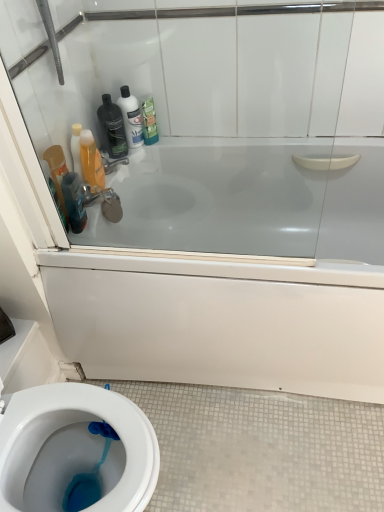
In order to click on translucent plastic bottle at upper center, arranged as the 2th cleaning product when viewed from the left in this screenshot , I will do `click(131, 117)`.

What do you see at coordinates (112, 162) in the screenshot? The image size is (384, 512). I see `matte silver faucet at upper left` at bounding box center [112, 162].

Describe the element at coordinates (74, 201) in the screenshot. I see `translucent plastic mouthwash at left, positioned as the first mouthwash in right-to-left order` at that location.

This screenshot has width=384, height=512. What do you see at coordinates (57, 174) in the screenshot?
I see `translucent plastic mouthwash at left, acting as the second mouthwash starting from the right` at bounding box center [57, 174].

This screenshot has height=512, width=384. Describe the element at coordinates (216, 120) in the screenshot. I see `transparent glass door at upper center` at that location.

Find the location of a particular element. Image resolution: width=384 pixels, height=512 pixels. translucent plastic bottle at upper center, the second cleaning product from the right is located at coordinates (131, 117).

Does point (59, 155) come closer to viewer compared to point (111, 139)?

Yes, point (59, 155) is in front of point (111, 139).

Consider the image. What's the angular difference between translucent plastic mouthwash at left, acting as the first mouthwash starting from the left, and matte black bottle at upper left's facing directions?

They differ by 35.9 degrees in their facing directions.

Which of these two, translucent plastic mouthwash at left, acting as the first mouthwash starting from the left, or matte black bottle at upper left, is smaller?

translucent plastic mouthwash at left, acting as the first mouthwash starting from the left.

Starting from the matte black bottle at upper left, which mouthwash is the 2nd one to the left? Please provide its 2D coordinates.

[(57, 174)]

Is translucent plastic mouthwash at left, which is the 2th mouthwash in left-to-right order, inside matte silver faucet at upper left?

No.

Considering the sizes of objects matte silver faucet at upper left and translucent plastic mouthwash at left, positioned as the first mouthwash in right-to-left order, in the image provided, who is thinner, matte silver faucet at upper left or translucent plastic mouthwash at left, positioned as the first mouthwash in right-to-left order,?

translucent plastic mouthwash at left, positioned as the first mouthwash in right-to-left order.

Is matte silver faucet at upper left in front of or behind translucent plastic mouthwash at left, which is the 2th mouthwash in left-to-right order, in the image?

matte silver faucet at upper left is positioned farther from the viewer than translucent plastic mouthwash at left, which is the 2th mouthwash in left-to-right order.

Can you see matte silver faucet at upper left touching translucent plastic mouthwash at left, positioned as the first mouthwash in right-to-left order?

No, matte silver faucet at upper left is not in contact with translucent plastic mouthwash at left, positioned as the first mouthwash in right-to-left order.

Is the position of white glossy bathtub at upper center more distant than that of translucent orange bottle at upper left, which appears as the 3th cleaning product when viewed from the right?

No, white glossy bathtub at upper center is closer to the camera.

Find the location of a particular element. This screenshot has width=384, height=512. bath on the right of translucent orange bottle at upper left, the 1th cleaning product in the left-to-right sequence is located at coordinates (240, 303).

From a real-world perspective, is white glossy bathtub at upper center physically located above or below translucent orange bottle at upper left, the 1th cleaning product in the left-to-right sequence?

white glossy bathtub at upper center is below translucent orange bottle at upper left, the 1th cleaning product in the left-to-right sequence.

Is white glossy bathtub at upper center far away from translucent orange bottle at upper left, which appears as the 3th cleaning product when viewed from the right?

No, white glossy bathtub at upper center is not far from translucent orange bottle at upper left, which appears as the 3th cleaning product when viewed from the right.

Which of these two, translucent plastic mouthwash at left, positioned as the first mouthwash in right-to-left order, or translucent plastic mouthwash at left, acting as the first mouthwash starting from the left, stands shorter?

Standing shorter between the two is translucent plastic mouthwash at left, positioned as the first mouthwash in right-to-left order.

Is translucent plastic mouthwash at left, acting as the second mouthwash starting from the right, at the back of translucent plastic mouthwash at left, which is the 2th mouthwash in left-to-right order?

Yes, translucent plastic mouthwash at left, which is the 2th mouthwash in left-to-right order,'s orientation is away from translucent plastic mouthwash at left, acting as the second mouthwash starting from the right.

Which is behind, point (80, 225) or point (58, 191)?

The point (80, 225) is farther.

Considering the sizes of translucent plastic mouthwash at left, positioned as the first mouthwash in right-to-left order, and translucent plastic mouthwash at left, acting as the second mouthwash starting from the right, in the image, is translucent plastic mouthwash at left, positioned as the first mouthwash in right-to-left order, wider or thinner than translucent plastic mouthwash at left, acting as the second mouthwash starting from the right,?

Clearly, translucent plastic mouthwash at left, positioned as the first mouthwash in right-to-left order, has less width compared to translucent plastic mouthwash at left, acting as the second mouthwash starting from the right.

Considering the relative positions of translucent orange bottle at upper left, which appears as the 3th cleaning product when viewed from the right, and white glossy bathtub at upper center in the image provided, is translucent orange bottle at upper left, which appears as the 3th cleaning product when viewed from the right, to the left or to the right of white glossy bathtub at upper center?

In the image, translucent orange bottle at upper left, which appears as the 3th cleaning product when viewed from the right, appears on the left side of white glossy bathtub at upper center.

From the picture: Does translucent orange bottle at upper left, the 1th cleaning product in the left-to-right sequence, touch white glossy bathtub at upper center?

translucent orange bottle at upper left, the 1th cleaning product in the left-to-right sequence, and white glossy bathtub at upper center are not in contact.

Considering the relative sizes of translucent orange bottle at upper left, which appears as the 3th cleaning product when viewed from the right, and white glossy bathtub at upper center in the image provided, is translucent orange bottle at upper left, which appears as the 3th cleaning product when viewed from the right, taller than white glossy bathtub at upper center?

In fact, translucent orange bottle at upper left, which appears as the 3th cleaning product when viewed from the right, may be shorter than white glossy bathtub at upper center.

Looking at this image, considering their positions, is translucent orange bottle at upper left, which appears as the 3th cleaning product when viewed from the right, located in front of or behind white glossy bathtub at upper center?

Visually, translucent orange bottle at upper left, which appears as the 3th cleaning product when viewed from the right, is located behind white glossy bathtub at upper center.

From a real-world perspective, who is located higher, translucent plastic mouthwash at left, which is the 2th mouthwash in left-to-right order, or translucent plastic bottle at upper center, the second cleaning product from the right?

In real-world perspective, translucent plastic bottle at upper center, the second cleaning product from the right, is above.

Considering the sizes of translucent plastic mouthwash at left, which is the 2th mouthwash in left-to-right order, and translucent plastic bottle at upper center, arranged as the 2th cleaning product when viewed from the left, in the image, is translucent plastic mouthwash at left, which is the 2th mouthwash in left-to-right order, taller or shorter than translucent plastic bottle at upper center, arranged as the 2th cleaning product when viewed from the left,?

translucent plastic mouthwash at left, which is the 2th mouthwash in left-to-right order, is shorter than translucent plastic bottle at upper center, arranged as the 2th cleaning product when viewed from the left.

Does point (71, 199) appear closer or farther from the camera than point (129, 104)?

Point (71, 199) appears to be closer to the viewer than point (129, 104).

Which is more to the right, translucent plastic mouthwash at left, positioned as the first mouthwash in right-to-left order, or translucent plastic bottle at upper center, the second cleaning product from the right?

translucent plastic bottle at upper center, the second cleaning product from the right, is more to the right.

Identify the location of toiletry above the white glossy bathtub at upper center (from a real-world perspective). This screenshot has height=512, width=384. (112, 127).

Between point (106, 114) and point (185, 284), which one is positioned in front?

Point (185, 284)

From a real-world perspective, which object rests below the other?

white glossy bathtub at upper center is physically lower.

From the image's perspective, is matte black bottle at upper left above or below white glossy bathtub at upper center?

Clearly, from the image's perspective, matte black bottle at upper left is above white glossy bathtub at upper center.

Identify the location of toiletry lying above the translucent plastic mouthwash at left, acting as the first mouthwash starting from the left (from the image's perspective). The width and height of the screenshot is (384, 512). (112, 127).

This screenshot has width=384, height=512. What are the coordinates of `tap to the right of translucent plastic mouthwash at left, positioned as the first mouthwash in right-to-left order` in the screenshot? It's located at point(112,162).

Looking at the image, which one is located further to translucent plastic bottle at upper center, arranged as the 2th cleaning product when viewed from the left, white glossy bathtub at upper center or translucent orange bottle at upper left, which appears as the 3th cleaning product when viewed from the right?

Based on the image, white glossy bathtub at upper center appears to be further to translucent plastic bottle at upper center, arranged as the 2th cleaning product when viewed from the left.

Considering their positions, is white glossy bathtub at upper center positioned further to translucent plastic mouthwash at left, acting as the first mouthwash starting from the left, than matte silver faucet at upper left?

The object further to translucent plastic mouthwash at left, acting as the first mouthwash starting from the left, is white glossy bathtub at upper center.

Consider the image. Estimate the real-world distances between objects in this image. Which object is closer to white glossy bathtub at upper center, transparent glass door at upper center or translucent orange bottle at upper left, the 1th cleaning product in the left-to-right sequence?

Among the two, transparent glass door at upper center is located nearer to white glossy bathtub at upper center.

From the image, which object appears to be nearer to translucent plastic bottle at upper center, arranged as the 2th cleaning product when viewed from the left, translucent orange bottle at upper left, which appears as the 3th cleaning product when viewed from the right, or green matte bottle at upper center, the 1th cleaning product viewed from the right?

green matte bottle at upper center, the 1th cleaning product viewed from the right, lies closer to translucent plastic bottle at upper center, arranged as the 2th cleaning product when viewed from the left, than the other object.

Estimate the real-world distances between objects in this image. Which object is further from transparent glass door at upper center, translucent plastic mouthwash at left, acting as the first mouthwash starting from the left, or translucent plastic bottle at upper center, the second cleaning product from the right?

Among the two, translucent plastic mouthwash at left, acting as the first mouthwash starting from the left, is located further to transparent glass door at upper center.

Consider the image. When comparing their distances from translucent plastic mouthwash at left, which is the 2th mouthwash in left-to-right order, does matte black bottle at upper left or translucent plastic mouthwash at left, acting as the first mouthwash starting from the left, seem closer?

translucent plastic mouthwash at left, acting as the first mouthwash starting from the left, is closer to translucent plastic mouthwash at left, which is the 2th mouthwash in left-to-right order.

Considering their positions, is white glossy bathtub at upper center positioned further to translucent orange bottle at upper left, the 1th cleaning product in the left-to-right sequence, than matte black bottle at upper left?

Based on the image, white glossy bathtub at upper center appears to be further to translucent orange bottle at upper left, the 1th cleaning product in the left-to-right sequence.

Looking at the image, which one is located closer to green matte bottle at upper center, arranged as the 3th cleaning product when viewed from the left, translucent plastic bottle at upper center, the second cleaning product from the right, or translucent orange bottle at upper left, which appears as the 3th cleaning product when viewed from the right?

translucent plastic bottle at upper center, the second cleaning product from the right.

Find the location of a particular element. The image size is (384, 512). toiletry between translucent plastic mouthwash at left, which is the 2th mouthwash in left-to-right order, and white glossy bathtub at upper center, in the horizontal direction is located at coordinates (112, 127).

Locate an element on the screen. glass door between translucent plastic mouthwash at left, acting as the first mouthwash starting from the left, and white glossy bathtub at upper center is located at coordinates (216, 120).

The height and width of the screenshot is (512, 384). I want to click on toiletry between translucent plastic mouthwash at left, acting as the second mouthwash starting from the right, and matte silver faucet at upper left from front to back, so click(112, 127).

Locate an element on the screen. Image resolution: width=384 pixels, height=512 pixels. cleaning product located between translucent plastic mouthwash at left, acting as the second mouthwash starting from the right, and matte silver faucet at upper left in the depth direction is located at coordinates (91, 160).